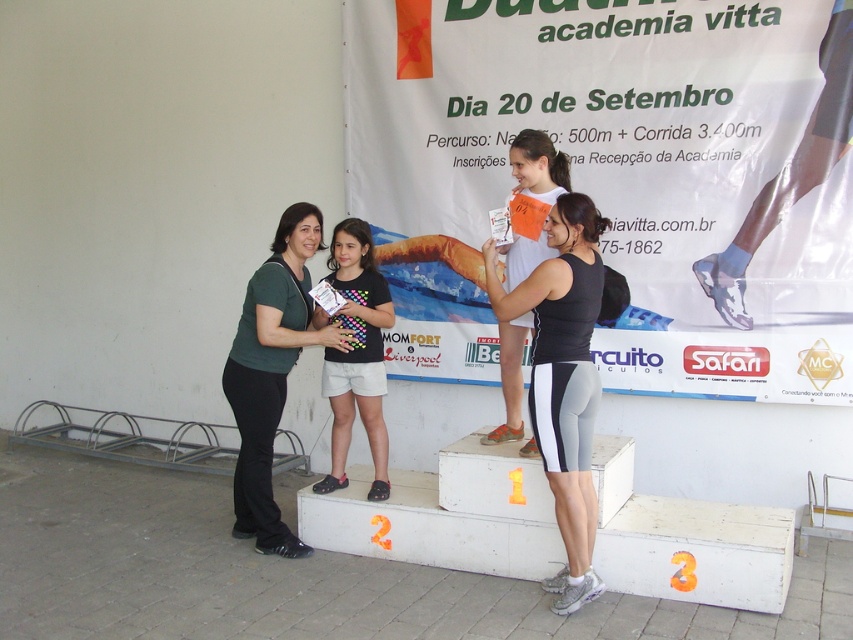
Is black matte tank top at center shorter than black fabric shirt at center?

Incorrect, black matte tank top at center's height does not fall short of black fabric shirt at center's.

Describe the element at coordinates (563, 378) in the screenshot. I see `black matte tank top at center` at that location.

Identify the location of black matte tank top at center. (563, 378).

Is black matte tank top at center thinner than green matte shirt at center?

Correct, black matte tank top at center's width is less than green matte shirt at center's.

This screenshot has width=853, height=640. What are the coordinates of `black matte tank top at center` in the screenshot? It's located at (563, 378).

At what (x,y) coordinates should I click in order to perform the action: click on black matte tank top at center. Please return your answer as a coordinate pair (x, y). This screenshot has height=640, width=853. Looking at the image, I should click on (563, 378).

Is black matte tank top at center shorter than orange paper tag at center?

In fact, black matte tank top at center may be taller than orange paper tag at center.

Between black matte tank top at center and orange paper tag at center, which one is positioned lower?

Positioned lower is black matte tank top at center.

Image resolution: width=853 pixels, height=640 pixels. In order to click on black matte tank top at center in this screenshot , I will do `click(563, 378)`.

The width and height of the screenshot is (853, 640). Identify the location of black matte tank top at center. (563, 378).